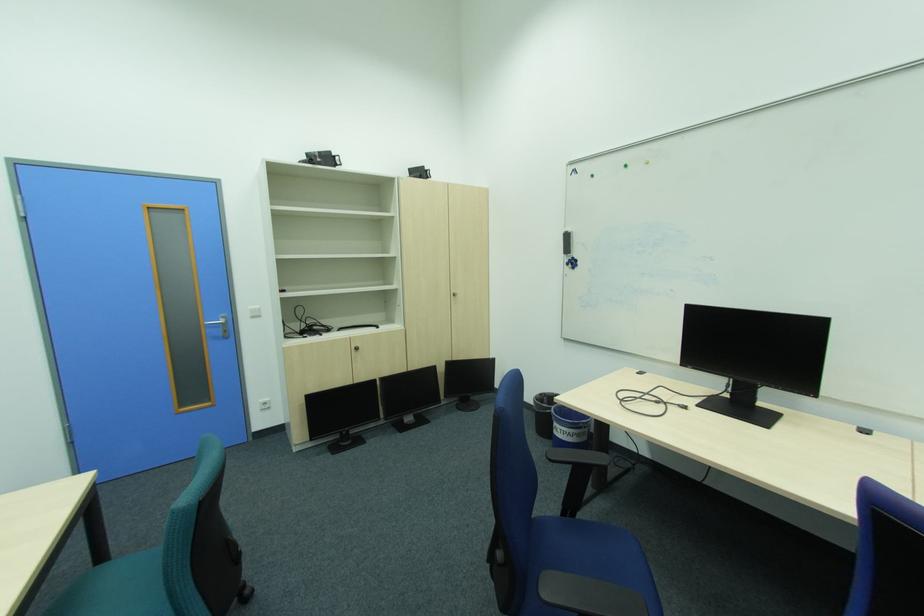
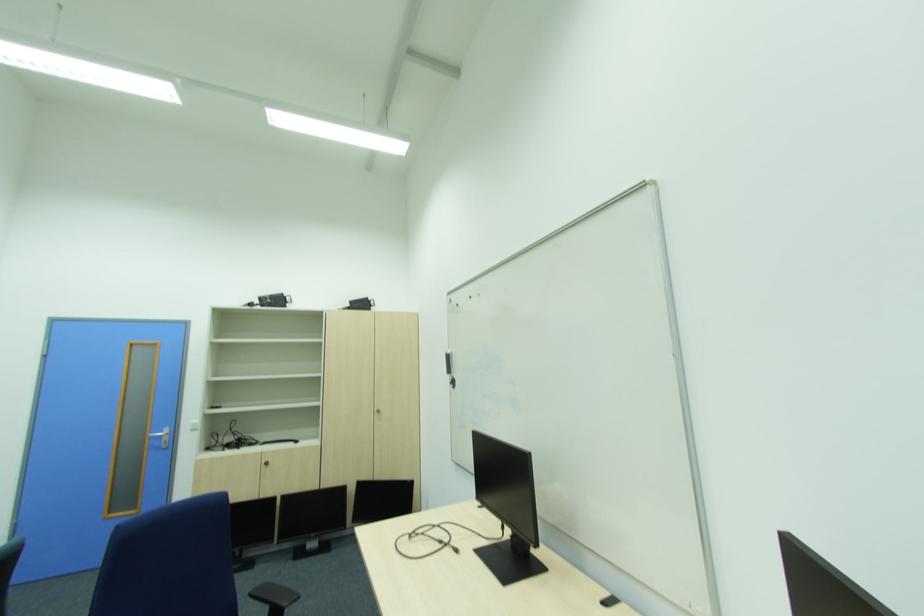
Question: The images are taken continuously from a first-person perspective. In which direction are you moving?

Choices:
 (A) Left
 (B) Right
 (C) Forward
 (D) Backward

Answer: (B)